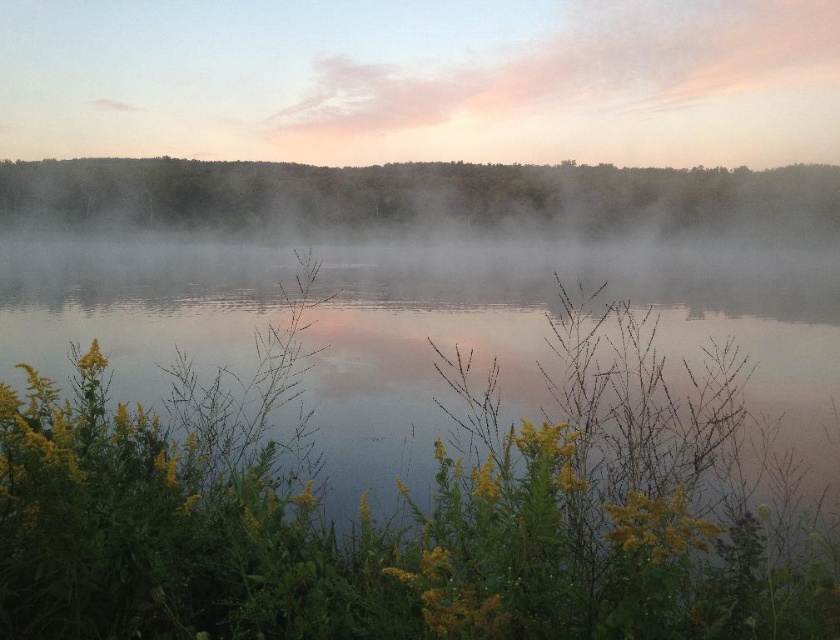
You are a photographer standing at the edge of the lake. You want to capture a photo that includes both the transparent misty water at center and the green leafy trees at upper center. Given that your camera can focus on objects up to 10 meters away, will both elements be in focus in the same shot?

The distance between the transparent misty water at center and green leafy trees at upper center is 10.65 meters. Since your camera can focus up to 10 meters, the elements are slightly beyond the focus range, so they might not both be in focus simultaneously.